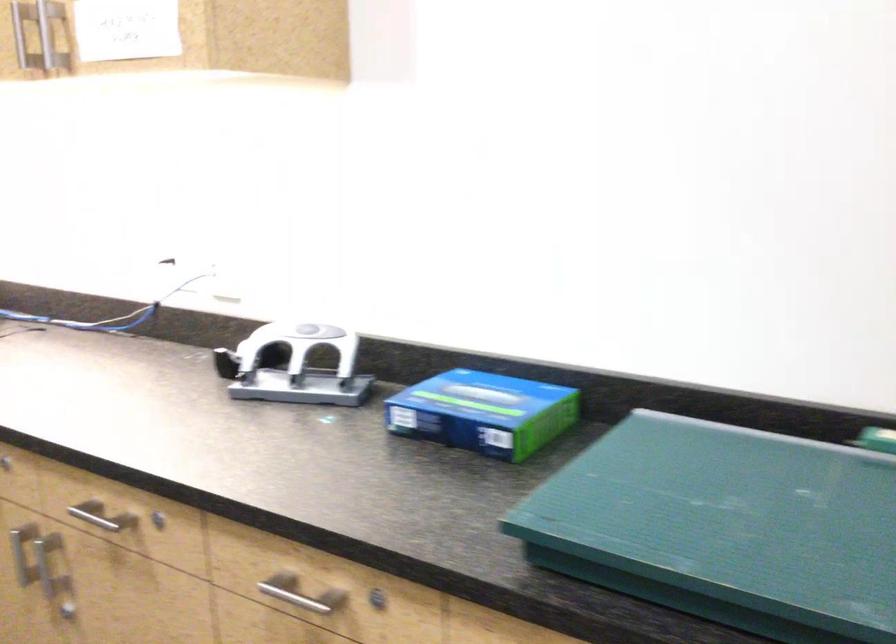
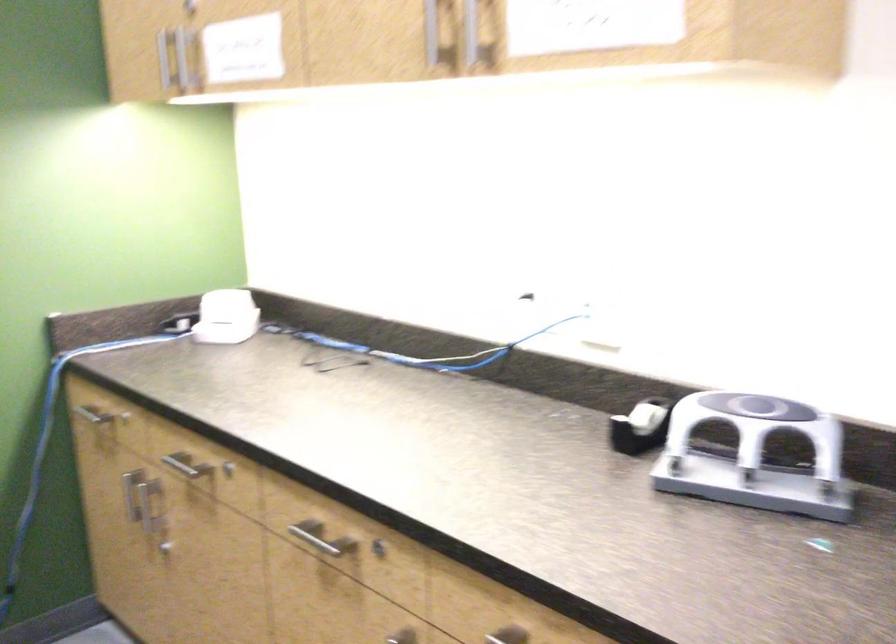
In the second image, find the point that corresponds to (101,506) in the first image.

(507, 635)